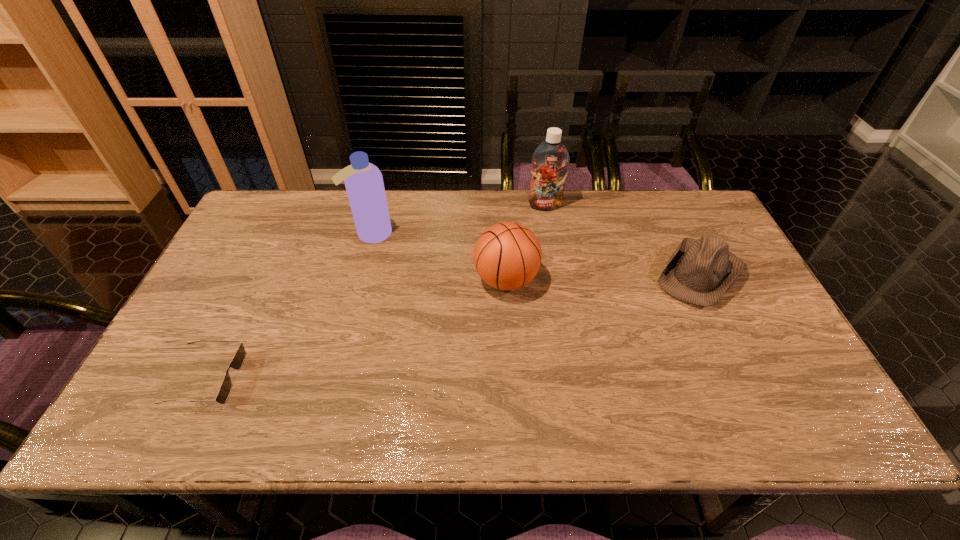
Identify the location of free point at the left edge. This screenshot has width=960, height=540. (183, 367).

The height and width of the screenshot is (540, 960). I want to click on vacant region at the right edge, so click(x=725, y=318).

You are a GUI agent. You are given a task and a screenshot of the screen. Output one action in this format:
    pyautogui.click(x=<x>, y=<y>)
    Task: Click on the vacant space at the far left corner of the desktop
    This screenshot has width=960, height=540.
    Given the screenshot: What is the action you would take?
    pyautogui.click(x=278, y=202)

Where is `vacant space at the near left corner of the desktop`? vacant space at the near left corner of the desktop is located at coordinates (186, 406).

Locate an element on the screen. The width and height of the screenshot is (960, 540). blank region between the basketball and the fourth object from right to left is located at coordinates (439, 257).

Locate an element on the screen. This screenshot has height=540, width=960. free point between the fourth object from right to left and the farther shampoo is located at coordinates (458, 220).

Where is `vacant area that lies between the basketball and the rightmost object`? This screenshot has height=540, width=960. vacant area that lies between the basketball and the rightmost object is located at coordinates (603, 277).

Where is `vacant region between the basketball and the nearer shampoo`? vacant region between the basketball and the nearer shampoo is located at coordinates (439, 257).

Identify the location of free area in between the farther shampoo and the second shortest object. The image size is (960, 540). (622, 240).

You are a GUI agent. You are given a task and a screenshot of the screen. Output one action in this format:
    pyautogui.click(x=<x>, y=<y>)
    Task: Click on the vacant point located between the leftmost object and the fedora
    Image resolution: width=960 pixels, height=540 pixels.
    Given the screenshot: What is the action you would take?
    pyautogui.click(x=453, y=326)